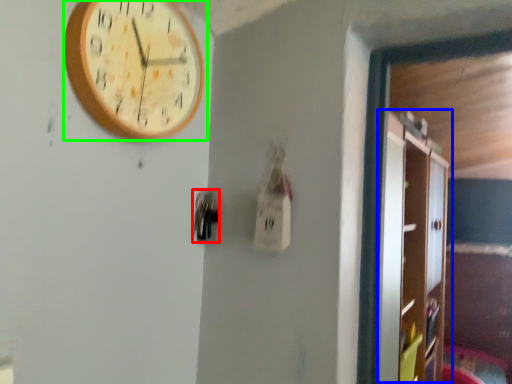
Question: Considering the real-world distances, which object is farthest from door handle (highlighted by a red box)? dresser (highlighted by a blue box) or wall clock (highlighted by a green box)?

Choices:
 (A) dresser
 (B) wall clock

Answer: (A)